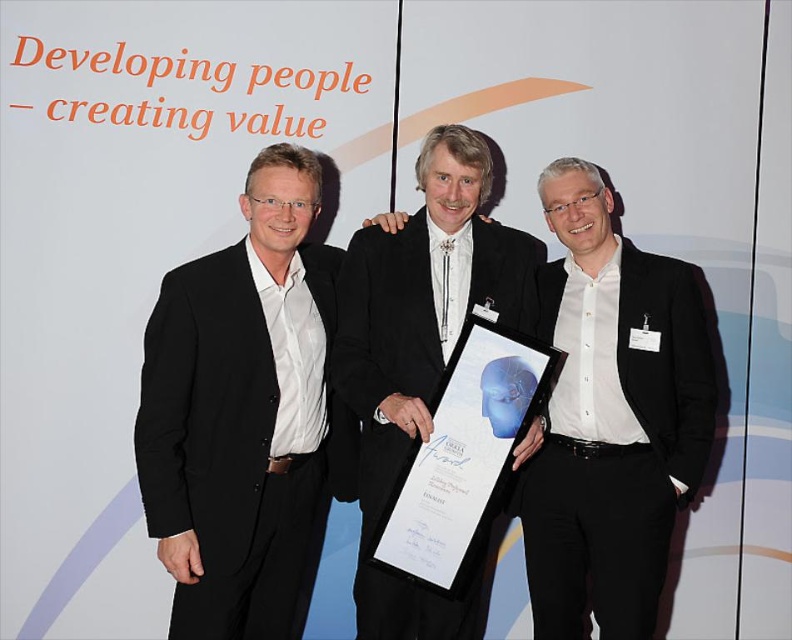
You are an event organizer who needs to ensure all participants are visible in group photos. Based on the scene, which clothing item, the white glossy shirt at center or the black satin suit at center, would make the person stand out more in the photo?

The black satin suit at center occupies more space than the white glossy shirt at center, so the black satin suit at center would make the person stand out more in the photo.

You are a photographer who needs to ensure that all clothing items in the photo are visible. The matte black suit at left and the white glossy shirt at center are two items you need to check. Based on their visibility, which clothing item might be harder to see in low light?

The matte black suit at left is thinner than the white glossy shirt at center, so it might be harder to see in low light because matte black surfaces generally absorb more light and have less reflective properties compared to white glossy materials.

You are attending a corporate event and notice two items at the center of the scene. Which item is closer to you between the white glossy shirt at center and the black satin suit at center?

The white glossy shirt at center is closer to you because the black satin suit at center is behind it.